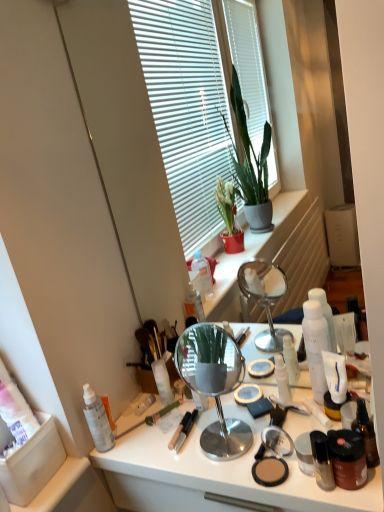
This screenshot has width=384, height=512. I want to click on free space to the left of white glossy lotion at center, placed as the third toiletry when sorted from left to right, so click(x=222, y=418).